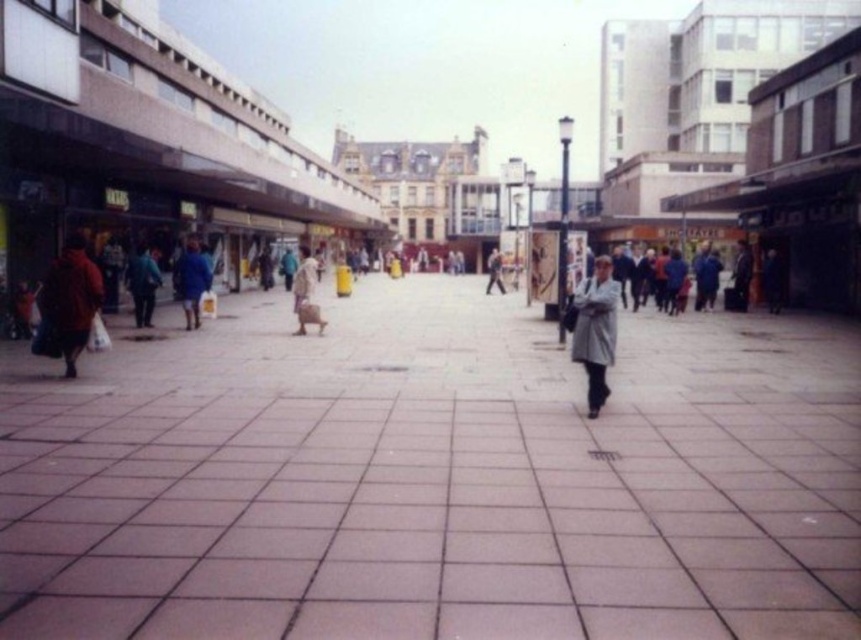
You are standing at the entrance of the plaza and want to find the light gray coat at center. According to the coordinates provided, in which direction should you walk to reach it?

The light gray coat at center is located at coordinates point (596, 330). Since you are at the entrance, you should walk towards the center of the plaza to reach it.

You are a delivery person who needs to place both the light brown fabric bag at center and the matte gray coat at center into a storage locker. The locker has a height limit of 30 cm. Which item might exceed the height limit?

The matte gray coat at center is taller than the light brown fabric bag at center, so it might exceed the 30 cm height limit.

You are a photographer standing in the plaza and you want to take a photo of the light gray coat at center from a distance. What is the minimum distance you need to maintain to ensure the camera can capture the entire coat in the frame?

The light gray coat at center and camera are 31.57 feet apart from each other, so you need to maintain a distance of at least 31.57 feet to ensure the camera can capture the entire coat in the frame.